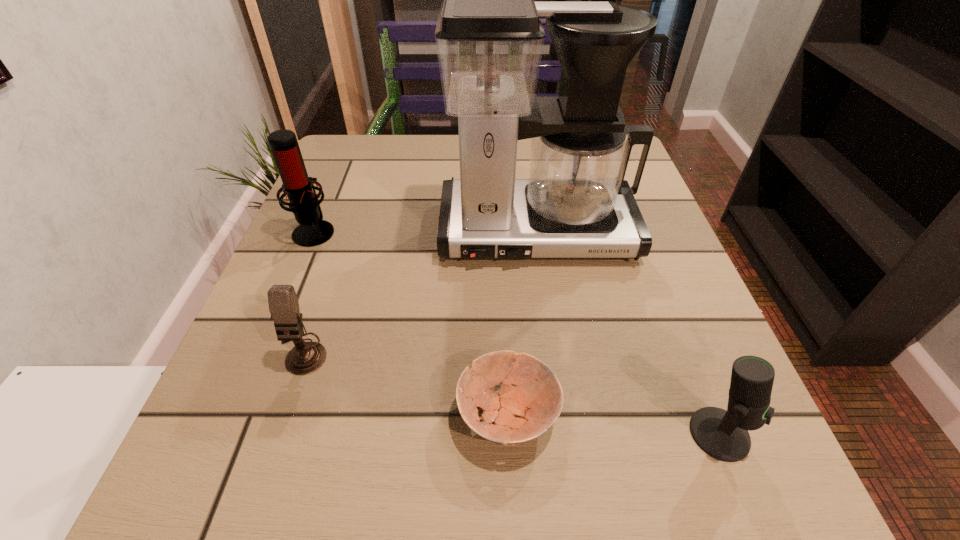
Where is `free location at the far left corner`? This screenshot has width=960, height=540. free location at the far left corner is located at coordinates (327, 160).

Where is `unoccupied position between the bowl and the nearest microphone`? This screenshot has height=540, width=960. unoccupied position between the bowl and the nearest microphone is located at coordinates (613, 424).

This screenshot has height=540, width=960. I want to click on blank region between the tallest microphone and the shortest object, so [x=411, y=323].

At what (x,y) coordinates should I click in order to perform the action: click on empty location between the shortest object and the second nearest microphone. Please return your answer as a coordinate pair (x, y). This screenshot has height=540, width=960. Looking at the image, I should click on (405, 384).

This screenshot has width=960, height=540. What are the coordinates of `empty space that is in between the second farthest microphone and the tallest object` in the screenshot? It's located at (420, 293).

The image size is (960, 540). Identify the location of empty space that is in between the tallest microphone and the shortest object. (411, 323).

The height and width of the screenshot is (540, 960). I want to click on free spot between the second nearest microphone and the shortest object, so click(x=405, y=384).

The image size is (960, 540). What are the coordinates of `empty location between the coffee maker and the second farthest microphone` in the screenshot? It's located at (420, 293).

You are a GUI agent. You are given a task and a screenshot of the screen. Output one action in this format:
    pyautogui.click(x=<x>, y=<y>)
    Task: Click on the empty location between the shortest object and the farthest microphone
    
    Given the screenshot: What is the action you would take?
    pyautogui.click(x=411, y=323)

Where is `vacant point located between the bowl and the second tallest object`? This screenshot has height=540, width=960. vacant point located between the bowl and the second tallest object is located at coordinates (411, 323).